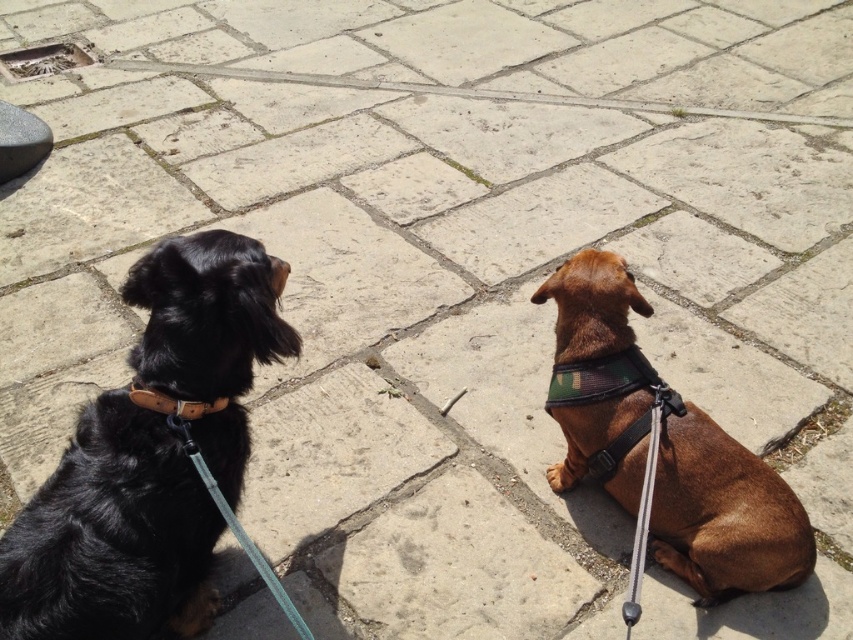
You are a dog owner who wants to ensure your pets are properly identified. You have two dogs in the image, one wearing a black leather collar at left and the other with a camouflage fabric neckband at center. Which collar has a taller height?

The black leather collar at left has a greater height compared to the camouflage fabric neckband at center, so the black leather collar at left is taller.

You are a dog owner who wants to attach a new leash to your dog. You see the point at coordinates point (112, 536). Which object is this point located on?

The point at coordinates point (112, 536) is located on the black leather collar at left.